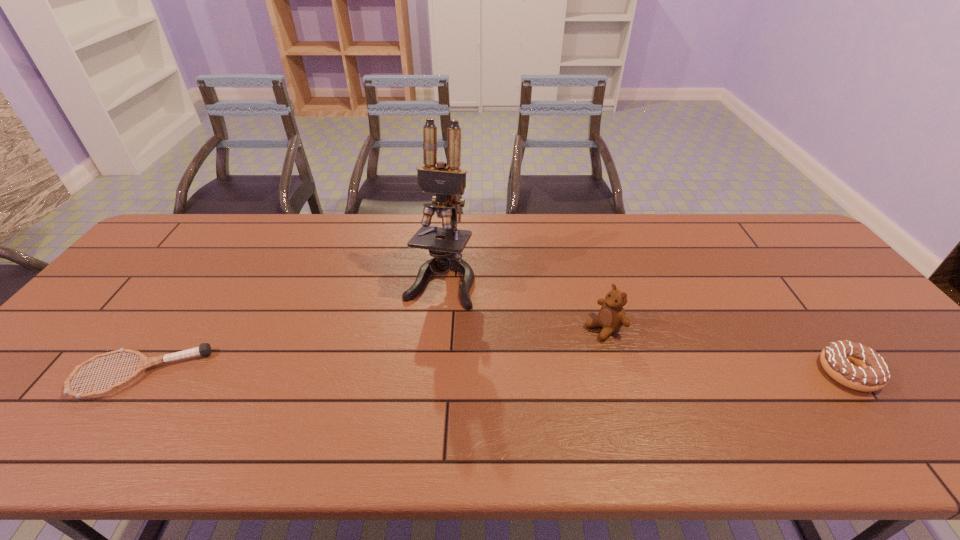
In order to click on free location that satisfies the following two spatial constraints: 1. on the back side of the microscope; 2. on the right side of the shortest object in this screenshot , I will do `click(207, 279)`.

The height and width of the screenshot is (540, 960). In order to click on free location that satisfies the following two spatial constraints: 1. on the back side of the doughnut; 2. on the left side of the shortest object in this screenshot , I will do `click(141, 372)`.